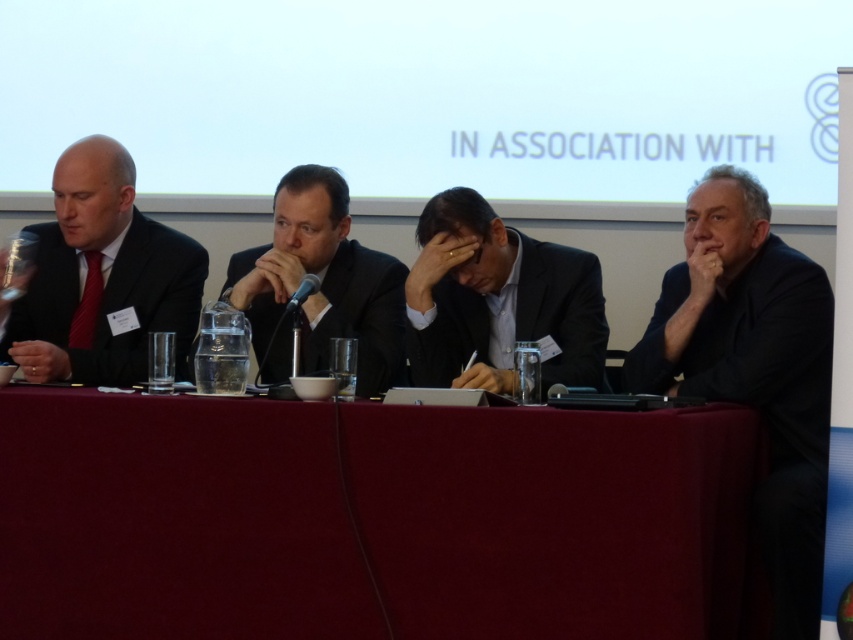
Does dark gray suit at center have a lesser height compared to black plastic microphone at center?

In fact, dark gray suit at center may be taller than black plastic microphone at center.

Measure the distance from dark gray suit at center to black plastic microphone at center.

dark gray suit at center and black plastic microphone at center are 64.39 centimeters apart from each other.

Is point (454, 292) positioned before point (308, 278)?

No, it is behind (308, 278).

The width and height of the screenshot is (853, 640). I want to click on dark gray suit at center, so click(498, 300).

Does matte black suit at left come in front of black plastic microphone at center?

That is False.

Does matte black suit at left appear under black plastic microphone at center?

Incorrect, matte black suit at left is not positioned below black plastic microphone at center.

Locate an element on the screen. This screenshot has height=640, width=853. matte black suit at left is located at coordinates (102, 276).

At what (x,y) coordinates should I click in order to perform the action: click on matte black suit at left. Please return your answer as a coordinate pair (x, y). Image resolution: width=853 pixels, height=640 pixels. Looking at the image, I should click on pyautogui.click(x=102, y=276).

Between point (312, 228) and point (312, 280), which one is positioned in front?

Point (312, 280)

Where is `black suit at center`? Image resolution: width=853 pixels, height=640 pixels. black suit at center is located at coordinates (320, 285).